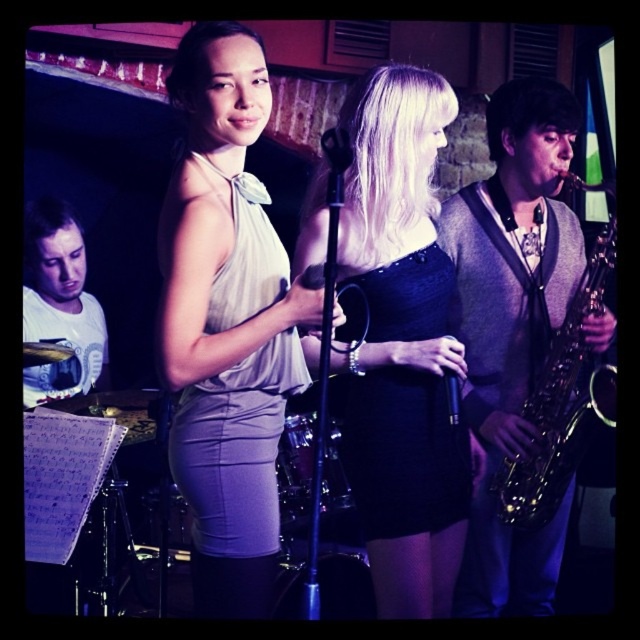
Looking at this image, based on the scene description, where is the satin beige dress at center located in terms of coordinates?

The satin beige dress at center is located at point (227, 323).

You are a stagehand setting up equipment for the band. You have to place the gold shiny saxophone at right and the black matte microphone at center. Given that the saxophone is larger, which object requires more space to accommodate its size?

The gold shiny saxophone at right requires more space because it is larger in size than the black matte microphone at center.